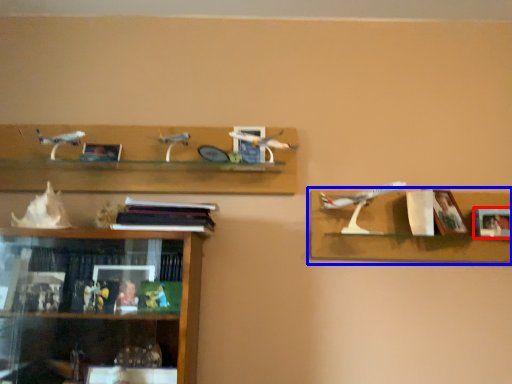
Question: Which object is further to the camera taking this photo, picture frame (highlighted by a red box) or shelf (highlighted by a blue box)?

Choices:
 (A) picture frame
 (B) shelf

Answer: (A)